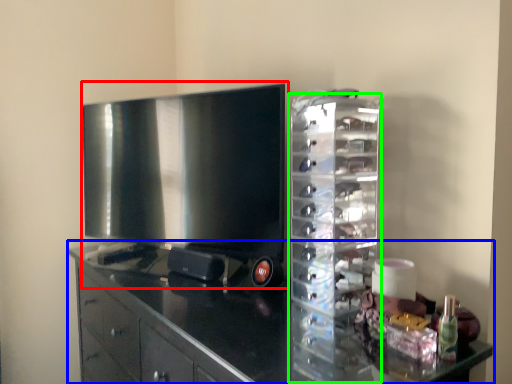
Question: Which object is the farthest from home appliance (highlighted by a red box)? Choose among these: cabinetry (highlighted by a blue box) or glass box (highlighted by a green box).

Choices:
 (A) cabinetry
 (B) glass box

Answer: (B)